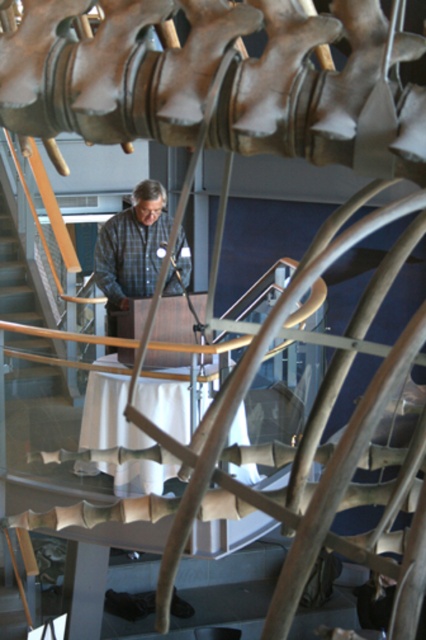
Question: Where is plaid shirt at center located in relation to wooden at left in the image?

Choices:
 (A) left
 (B) right

Answer: (B)

Question: Which point is closer to the camera?

Choices:
 (A) (114, 298)
 (B) (20, 257)

Answer: (A)

Question: Which of the following is the farthest from the observer?

Choices:
 (A) wooden at left
 (B) plaid shirt at center

Answer: (A)

Question: Is plaid shirt at center to the right of wooden at left from the viewer's perspective?

Choices:
 (A) no
 (B) yes

Answer: (B)

Question: Where is plaid shirt at center located in relation to wooden at left in the image?

Choices:
 (A) left
 (B) right

Answer: (B)